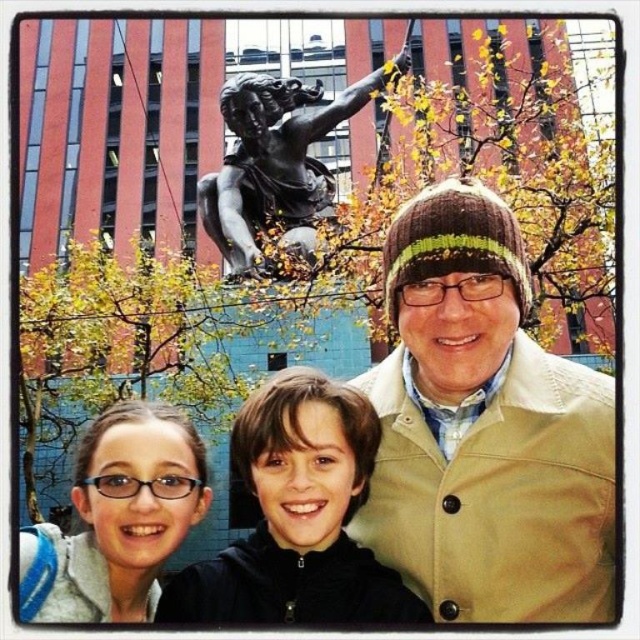
You are a photographer setting up for a family photo. You have a matte gray backpack at lower left and a bronze statue at upper center in your viewfinder. You need to ensure that both objects are visible in the frame. Based on their sizes, which object will appear smaller in the final photo?

The matte gray backpack at lower left will appear smaller in the final photo because its width is less than the bronze statue at upper center.

You are a photographer setting up a tripod to capture the scene. The matte gray backpack at lower left and bronze statue at upper center are both in your view. Which object is taller?

The bronze statue at upper center is taller than the matte gray backpack at lower left.